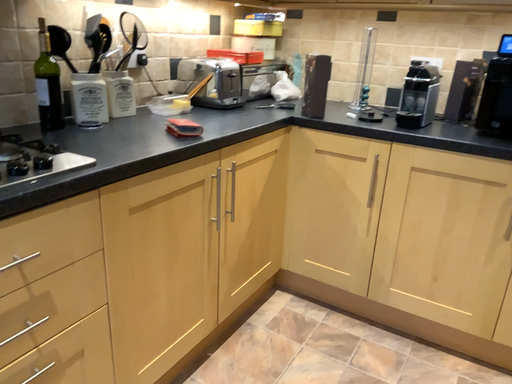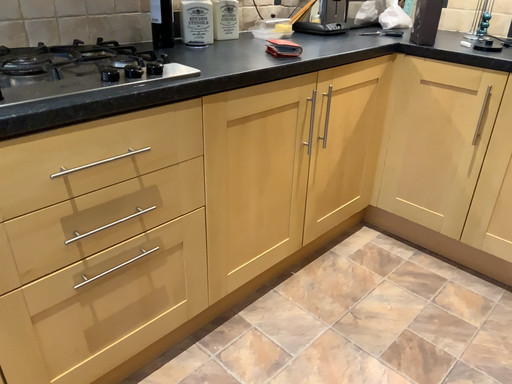
Question: How did the camera likely rotate when shooting the video?

Choices:
 (A) rotated downward
 (B) rotated upward

Answer: (A)